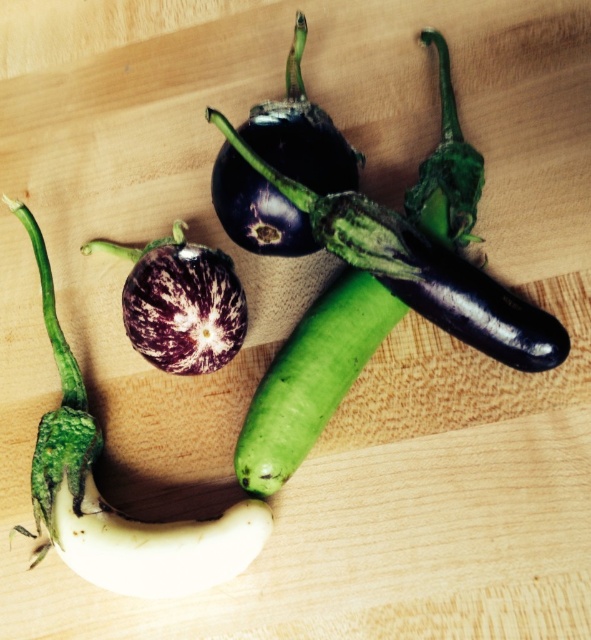
You are arranging vegetables on a wooden surface and have the white matte eggplant at center and the green smooth cucumber at center. Which vegetable takes up more space?

The white matte eggplant at center is bigger than the green smooth cucumber at center, so it takes up more space.

You are arranging vegetables on a wooden surface. You have a white matte eggplant at center and a purple striped eggplant at center. Where should you place a new cucumber so that it is between them?

Result: The white matte eggplant at center is to the left of the purple striped eggplant at center, so place the cucumber between them by positioning it to the right of the white matte eggplant at center and to the left of the purple striped eggplant at center.